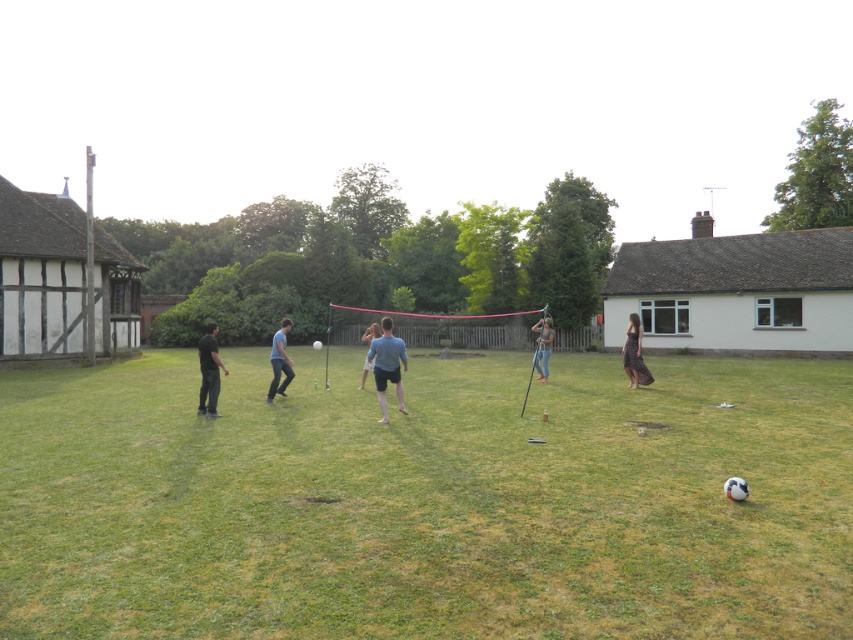
Question: Which point appears farthest from the camera in this image?

Choices:
 (A) (282, 365)
 (B) (373, 365)
 (C) (624, 349)
 (D) (370, 333)

Answer: (D)

Question: Can you confirm if green grass at center is positioned to the right of blue fabric shirt at center?

Choices:
 (A) no
 (B) yes

Answer: (A)

Question: In this image, where is green grass at center located relative to denim jeans at center?

Choices:
 (A) below
 (B) above

Answer: (A)

Question: Which point appears closest to the camera in this image?

Choices:
 (A) (549, 353)
 (B) (213, 340)
 (C) (378, 324)

Answer: (B)

Question: From the image, what is the correct spatial relationship of black lace dress at right in relation to blue jeans at center?

Choices:
 (A) left
 (B) right

Answer: (B)

Question: Which of the following is the farthest from the observer?

Choices:
 (A) (386, 412)
 (B) (215, 356)
 (C) (376, 326)
 (D) (662, 588)

Answer: (C)